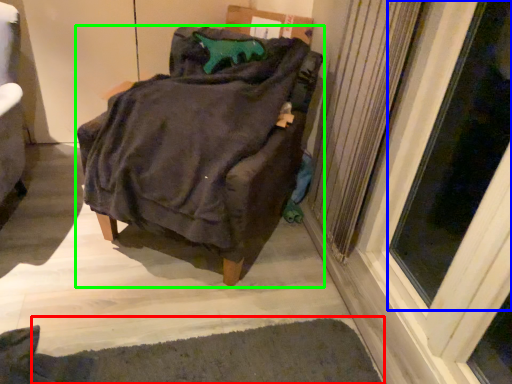
Question: Which object is positioned farthest from doormat (highlighted by a red box)? Select from screen door (highlighted by a blue box) and furniture (highlighted by a green box).

Choices:
 (A) screen door
 (B) furniture

Answer: (A)